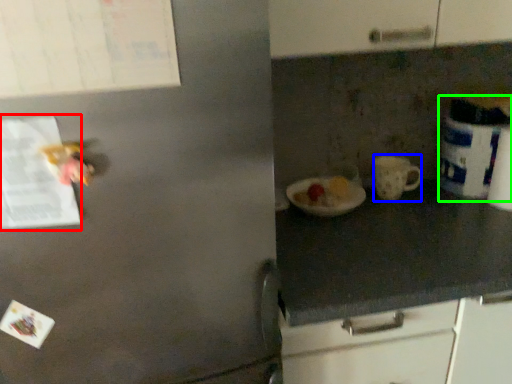
Question: Estimate the real-world distances between objects in this image. Which object is farther from paper (highlighted by a red box), mug (highlighted by a blue box) or appliance (highlighted by a green box)?

Choices:
 (A) mug
 (B) appliance

Answer: (B)